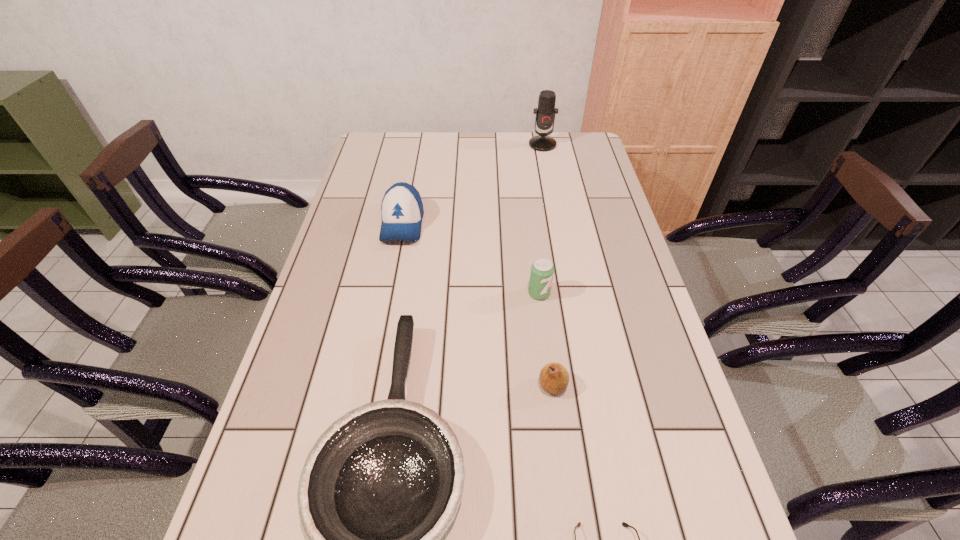
This screenshot has height=540, width=960. Identify the location of the tallest object. (545, 114).

The height and width of the screenshot is (540, 960). Identify the location of the farthest object. (545, 114).

The width and height of the screenshot is (960, 540). I want to click on baseball cap, so click(x=402, y=210).

I want to click on the fourth nearest object, so click(542, 270).

Image resolution: width=960 pixels, height=540 pixels. Find the location of `pear`. pear is located at coordinates (554, 378).

Locate an element on the screen. This screenshot has width=960, height=540. vacant space located on the side of the farthest object with the red ring is located at coordinates point(556,213).

At what (x,y) coordinates should I click in order to perform the action: click on vacant region located on the front-facing side of the baseball cap. Please return your answer as a coordinate pair (x, y). Looking at the image, I should click on (385, 315).

At what (x,y) coordinates should I click in order to perform the action: click on free spot located 0.380m on the front of the fourth nearest object. Please return your answer as a coordinate pair (x, y). The height and width of the screenshot is (540, 960). Looking at the image, I should click on (559, 447).

Find the location of `free location located 0.280m on the left of the third shortest object`. free location located 0.280m on the left of the third shortest object is located at coordinates (411, 386).

Where is `object situated at the far edge`? The height and width of the screenshot is (540, 960). object situated at the far edge is located at coordinates (545, 114).